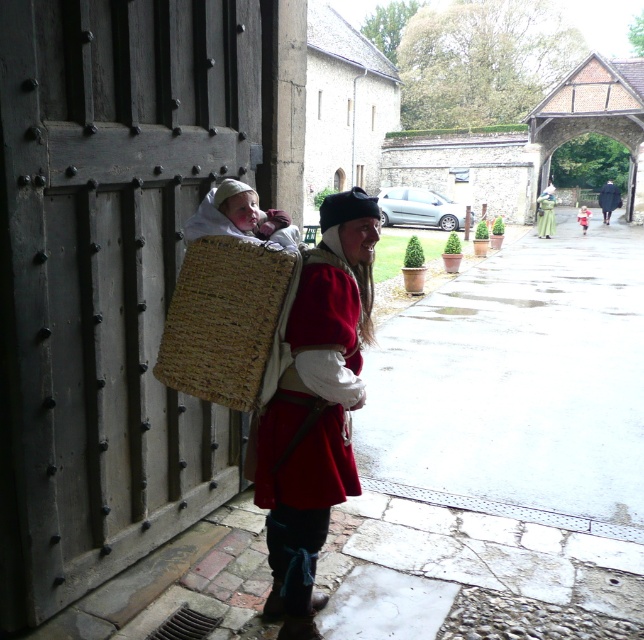
Question: Is soft beige fabric at center below dark blue wool coat at center?

Choices:
 (A) no
 (B) yes

Answer: (B)

Question: Is dark wood door at left further to camera compared to matte red coat at center?

Choices:
 (A) yes
 (B) no

Answer: (B)

Question: Estimate the real-world distances between objects in this image. Which object is closer to the matte red coat at center?

Choices:
 (A) dark wood door at left
 (B) dark blue wool coat at center

Answer: (A)

Question: Which point is closer to the camera?

Choices:
 (A) (222, 260)
 (B) (261, 236)
 (C) (251, 136)
 (D) (600, 196)

Answer: (A)

Question: Does soft beige fabric at center appear over green woolen robe at center?

Choices:
 (A) yes
 (B) no

Answer: (B)

Question: Which object is farther from the camera taking this photo?

Choices:
 (A) soft beige fabric at center
 (B) matte red coat at center
 (C) green woolen robe at center

Answer: (C)